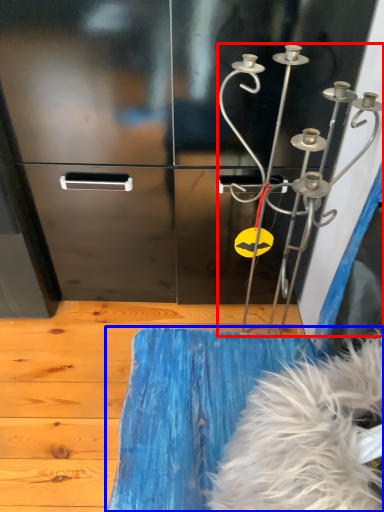
Question: Among these objects, which one is nearest to the camera, wind chime (highlighted by a red box) or furniture (highlighted by a blue box)?

Choices:
 (A) wind chime
 (B) furniture

Answer: (B)